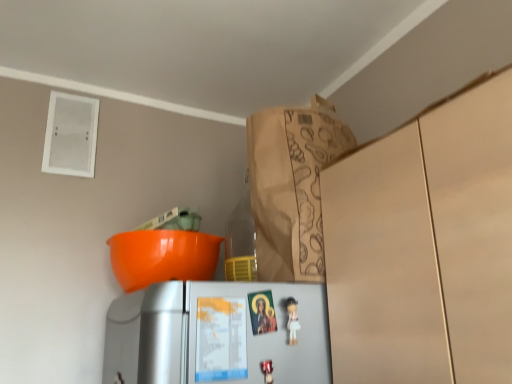
Question: Is brown paper bag at upper center inside the boundaries of white matte refrigerator at lower center, or outside?

Choices:
 (A) outside
 (B) inside

Answer: (A)

Question: Would you say brown paper bag at upper center is to the left or to the right of white matte refrigerator at lower center in the picture?

Choices:
 (A) left
 (B) right

Answer: (B)

Question: Which is nearer to the white matte refrigerator at lower center?

Choices:
 (A) brown paper bag at upper center
 (B) white glossy figurine at center

Answer: (B)

Question: Considering the real-world distances, which object is farthest from the white matte refrigerator at lower center?

Choices:
 (A) brown paper bag at upper center
 (B) white glossy figurine at center

Answer: (A)